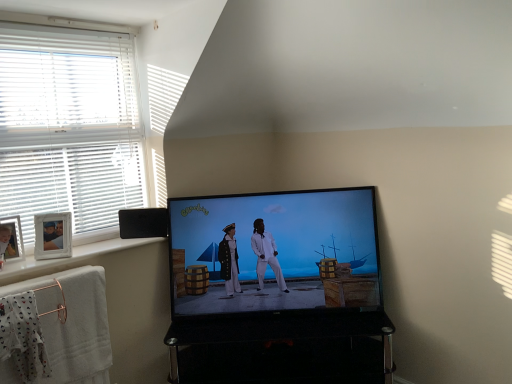
You are a GUI agent. You are given a task and a screenshot of the screen. Output one action in this format:
    pyautogui.click(x=<x>, y=<y>)
    Task: Click on the empty space that is ontop of white painted wood at lower left (from a real-world perspective)
    This screenshot has width=512, height=384.
    Given the screenshot: What is the action you would take?
    pyautogui.click(x=86, y=245)